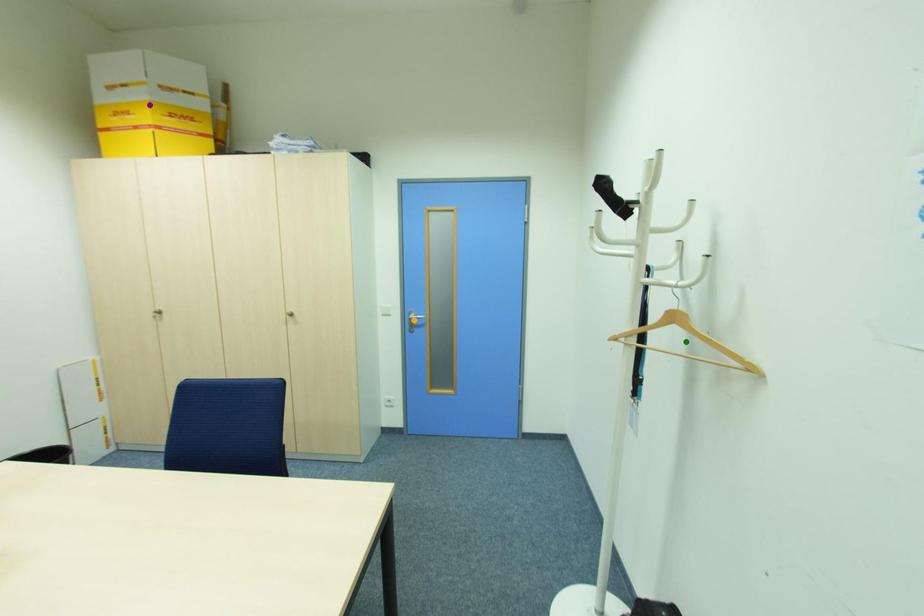
Order these from farthest to nearest:
- orange point
- green point
- purple point

orange point
purple point
green point